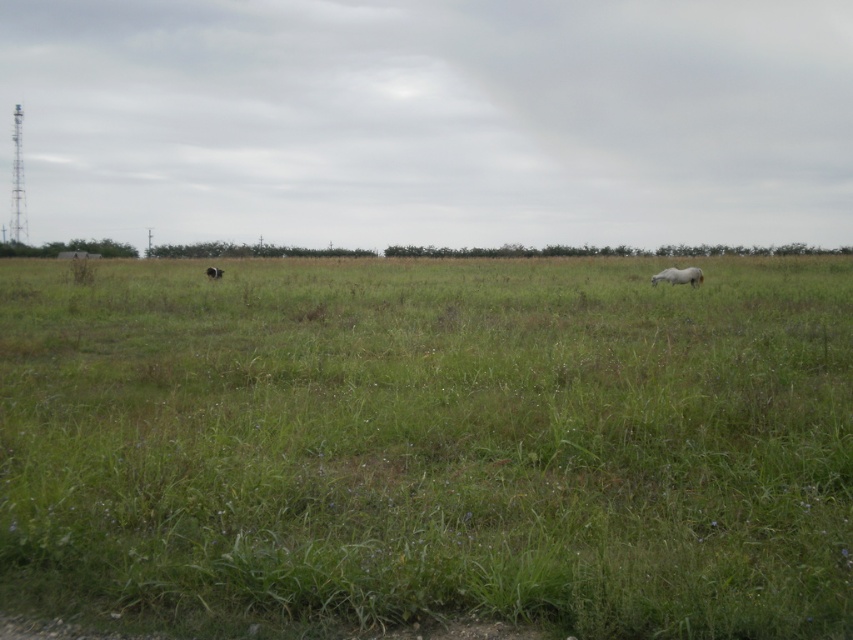
Question: Can you confirm if white fluffy horse at center is bigger than brown fuzzy dog at center?

Choices:
 (A) yes
 (B) no

Answer: (B)

Question: Can you confirm if white fluffy horse at center is positioned above brown fuzzy dog at center?

Choices:
 (A) yes
 (B) no

Answer: (B)

Question: Observing the image, what is the correct spatial positioning of green grass at center in reference to brown fuzzy dog at center?

Choices:
 (A) left
 (B) right

Answer: (B)

Question: Estimate the real-world distances between objects in this image. Which object is closer to the brown fuzzy dog at center?

Choices:
 (A) green grass at center
 (B) white fluffy horse at center

Answer: (A)

Question: Among these points, which one is farthest from the camera?

Choices:
 (A) (659, 275)
 (B) (215, 275)
 (C) (485, 284)

Answer: (B)

Question: Which is nearer to the brown fuzzy dog at center?

Choices:
 (A) white fluffy horse at center
 (B) green grass at center

Answer: (B)